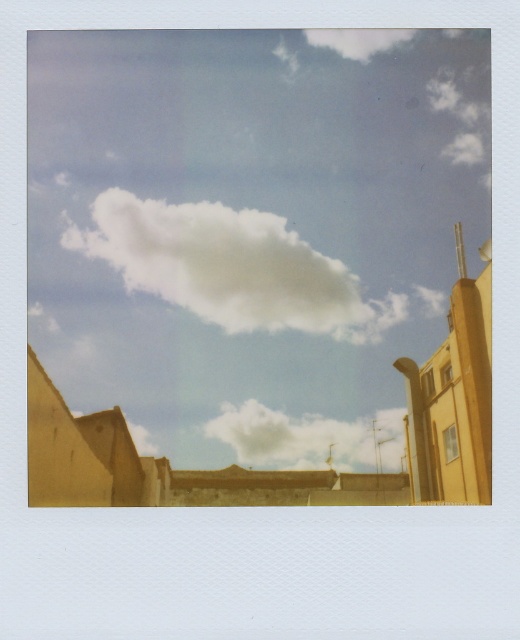
Question: Does white fluffy cloud at upper center have a smaller size compared to white fluffy cloud at center?

Choices:
 (A) no
 (B) yes

Answer: (B)

Question: Is white fluffy cloud at upper center further to the viewer compared to white fluffy cloud at center?

Choices:
 (A) no
 (B) yes

Answer: (B)

Question: Among these objects, which one is nearest to the camera?

Choices:
 (A) white fluffy cloud at upper center
 (B) white fluffy cloud at center

Answer: (B)

Question: Which of the following is the closest to the observer?

Choices:
 (A) (214, 426)
 (B) (192, 294)

Answer: (B)

Question: Does white fluffy cloud at upper center appear on the right side of white fluffy cloud at center?

Choices:
 (A) yes
 (B) no

Answer: (B)